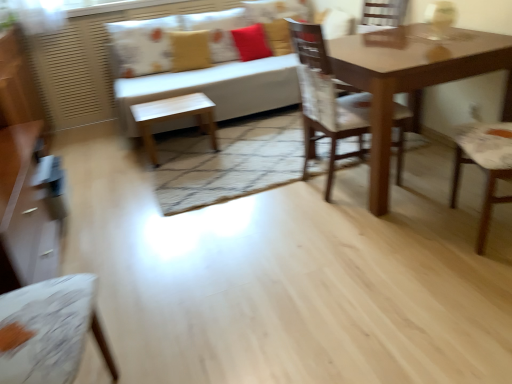
Question: Choose the correct answer: Is matte brown table at center inside printed fabric pillow at upper center, which is counted as the third pillow, starting from the right, or outside it?

Choices:
 (A) inside
 (B) outside

Answer: (B)

Question: From a real-world perspective, is matte brown table at center physically located above or below printed fabric pillow at upper center, which is counted as the third pillow, starting from the right?

Choices:
 (A) below
 (B) above

Answer: (A)

Question: Estimate the real-world distances between objects in this image. Which object is closer to the matte brown dresser at left?

Choices:
 (A) light wood/finely finished table at center
 (B) matte brown table at center
 (C) wooden chair at center
 (D) matte yellow pillow at upper center, arranged as the second pillow when viewed from the left
 (E) red velvet cushion at upper center, the 3th pillow positioned from the left

Answer: (A)

Question: Considering the real-world distances, which object is farthest from the red velvet cushion at upper center, the 1th pillow when ordered from right to left?

Choices:
 (A) white fabric couch at upper center
 (B) light wood/finely finished table at center
 (C) printed fabric pillow at upper center, which is counted as the third pillow, starting from the right
 (D) matte yellow pillow at upper center, which is the 2th pillow from right to left
 (E) wooden chair at center

Answer: (E)